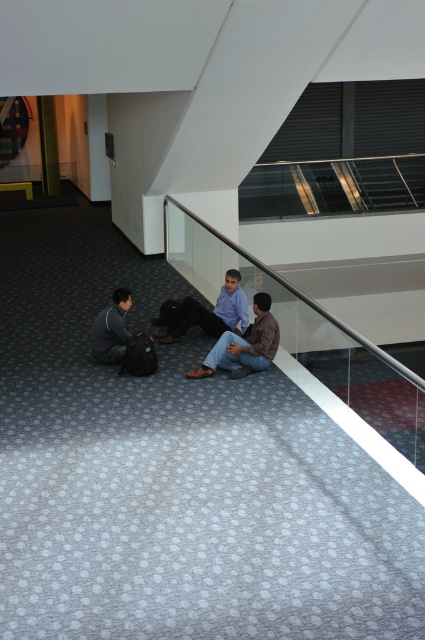
Where is `carpeted floor at lower center`? carpeted floor at lower center is located at coordinates (175, 474).

Can you confirm if carpeted floor at lower center is positioned below transparent glass escalator at lower center?

Correct, carpeted floor at lower center is located below transparent glass escalator at lower center.

Between point (91, 461) and point (271, 288), which one is positioned in front?

Point (91, 461)

Where is `carpeted floor at lower center`? carpeted floor at lower center is located at coordinates (175, 474).

Is carpeted floor at lower center to the left of brown leather jacket at center from the viewer's perspective?

Correct, you'll find carpeted floor at lower center to the left of brown leather jacket at center.

Is carpeted floor at lower center wider than brown leather jacket at center?

Correct, the width of carpeted floor at lower center exceeds that of brown leather jacket at center.

Locate an element on the screen. carpeted floor at lower center is located at coordinates (175, 474).

In the scene shown: Between carpeted floor at lower center and dark gray fabric jacket at lower left, which one appears on the left side from the viewer's perspective?

dark gray fabric jacket at lower left is more to the left.

Between carpeted floor at lower center and dark gray fabric jacket at lower left, which one has less height?

dark gray fabric jacket at lower left is shorter.

Is point (295, 604) positioned before point (95, 336)?

That is True.

The height and width of the screenshot is (640, 425). I want to click on carpeted floor at lower center, so pos(175,474).